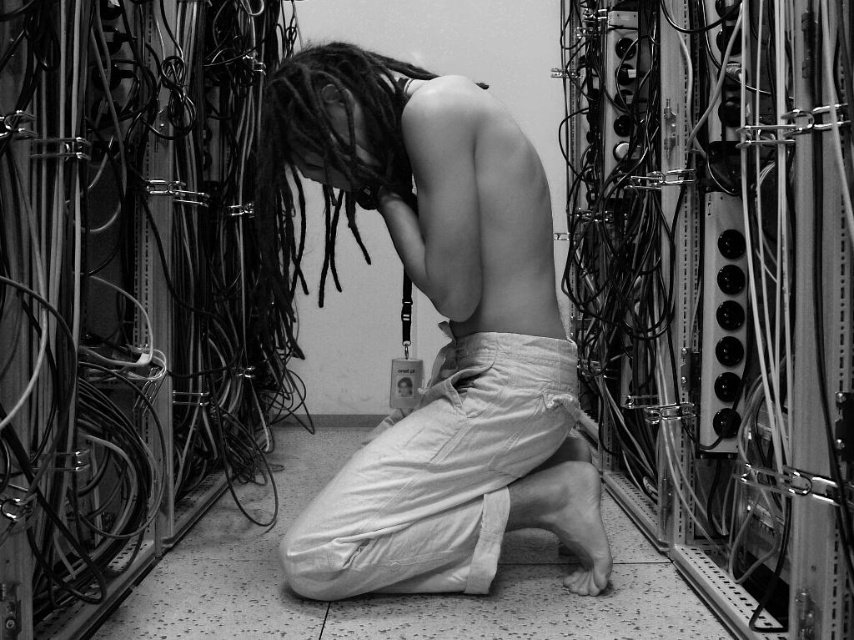
Who is more distant from viewer, (481,225) or (313,144)?

The point (313,144) is more distant.

Is smooth skin at back closer to the viewer compared to dark dreadlocks at center?

Yes, smooth skin at back is in front of dark dreadlocks at center.

Image resolution: width=854 pixels, height=640 pixels. What do you see at coordinates (475, 212) in the screenshot? I see `smooth skin at back` at bounding box center [475, 212].

Find the location of `smooth skin at back`. smooth skin at back is located at coordinates (475, 212).

Is matte white pants at center to the right of smooth skin at back from the viewer's perspective?

Incorrect, matte white pants at center is not on the right side of smooth skin at back.

Can you confirm if matte white pants at center is thinner than smooth skin at back?

No, matte white pants at center is not thinner than smooth skin at back.

Between point (529, 346) and point (541, 186), which one is positioned behind?

The point (529, 346) is more distant.

The height and width of the screenshot is (640, 854). I want to click on matte white pants at center, so click(442, 330).

The height and width of the screenshot is (640, 854). I want to click on light beige cotton pants at center, so click(x=437, y=474).

Which is below, light beige cotton pants at center or smooth skin at back?

light beige cotton pants at center is lower down.

Between point (453, 580) and point (472, 113), which one is positioned in front?

Point (472, 113) is in front.

Image resolution: width=854 pixels, height=640 pixels. I want to click on light beige cotton pants at center, so click(x=437, y=474).